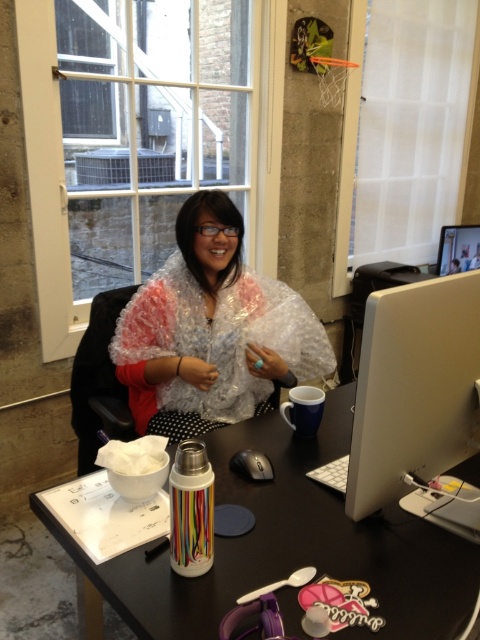
Question: Among these objects, which one is farthest from the camera?

Choices:
 (A) metallic thermos at center
 (B) sleek silver monitor at upper right

Answer: (B)

Question: In this image, where is sleek silver monitor at upper right located relative to blue ceramic mug at right?

Choices:
 (A) left
 (B) right

Answer: (B)

Question: Is sleek silver monitor at upper right smaller than blue ceramic mug at right?

Choices:
 (A) no
 (B) yes

Answer: (A)

Question: Which is nearer to the clear plastic bubble wrap at center?

Choices:
 (A) metallic thermos at center
 (B) sleek silver monitor at upper right

Answer: (A)

Question: Can you confirm if metallic thermos at center is positioned to the left of blue ceramic mug at right?

Choices:
 (A) yes
 (B) no

Answer: (A)

Question: Which object is positioned farthest from the blue ceramic mug at right?

Choices:
 (A) sleek silver monitor at upper right
 (B) metallic thermos at center
 (C) clear plastic bubble wrap at center

Answer: (A)